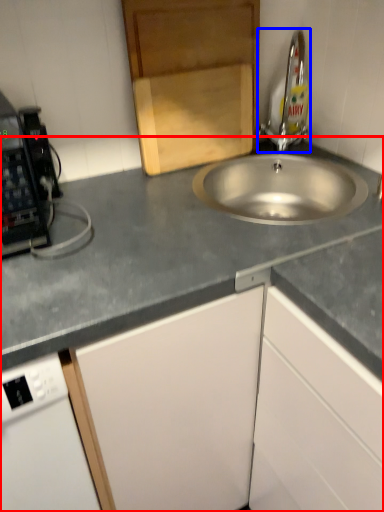
Question: Which object is closer to the camera taking this photo, countertop (highlighted by a red box) or tap (highlighted by a blue box)?

Choices:
 (A) countertop
 (B) tap

Answer: (A)